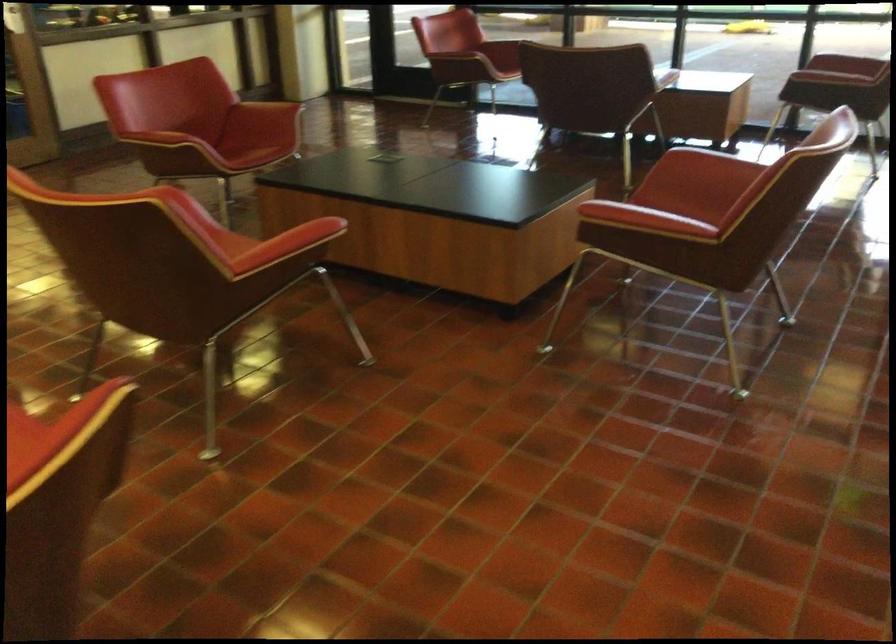
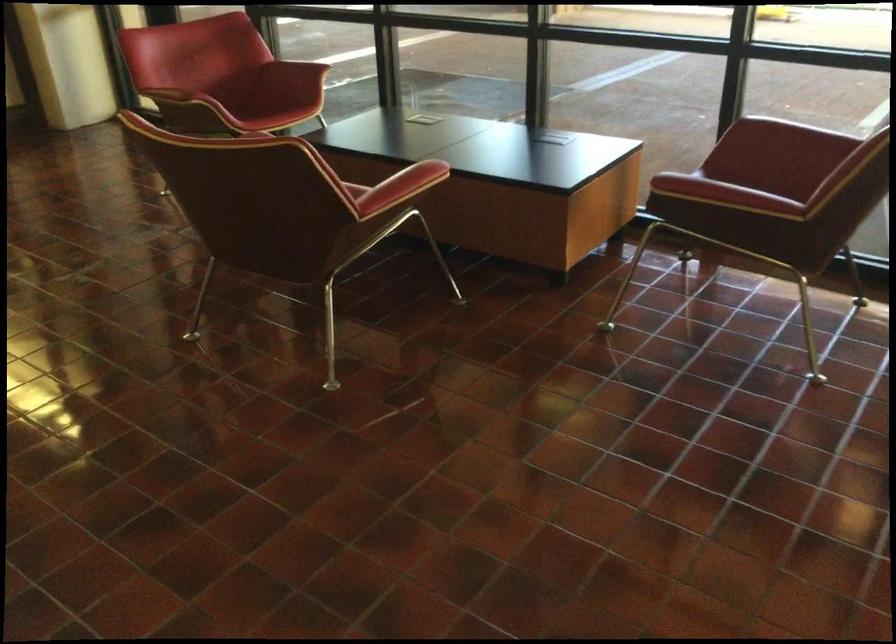
Which direction would the cameraman need to move to produce the second image?

The movement direction of the cameraman is right, forward.